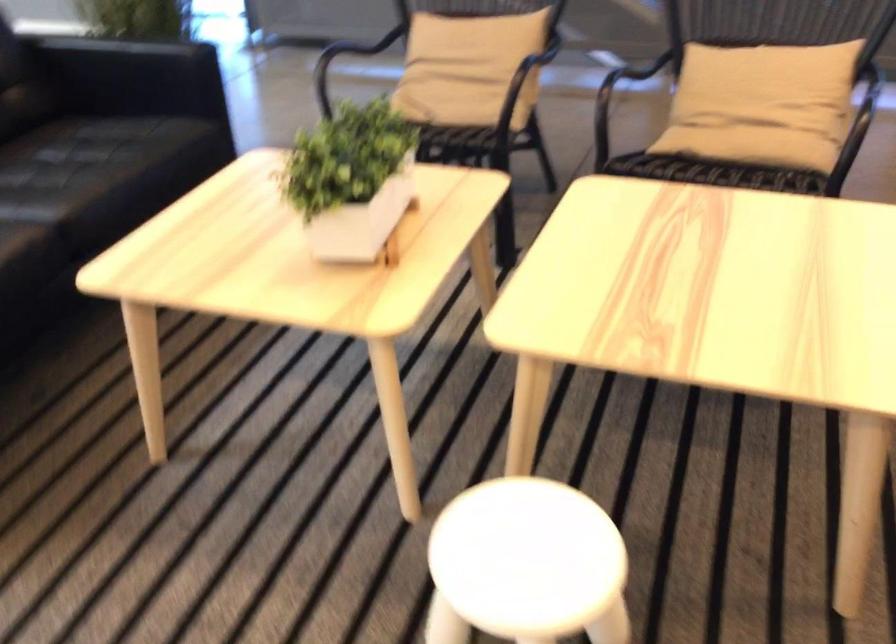
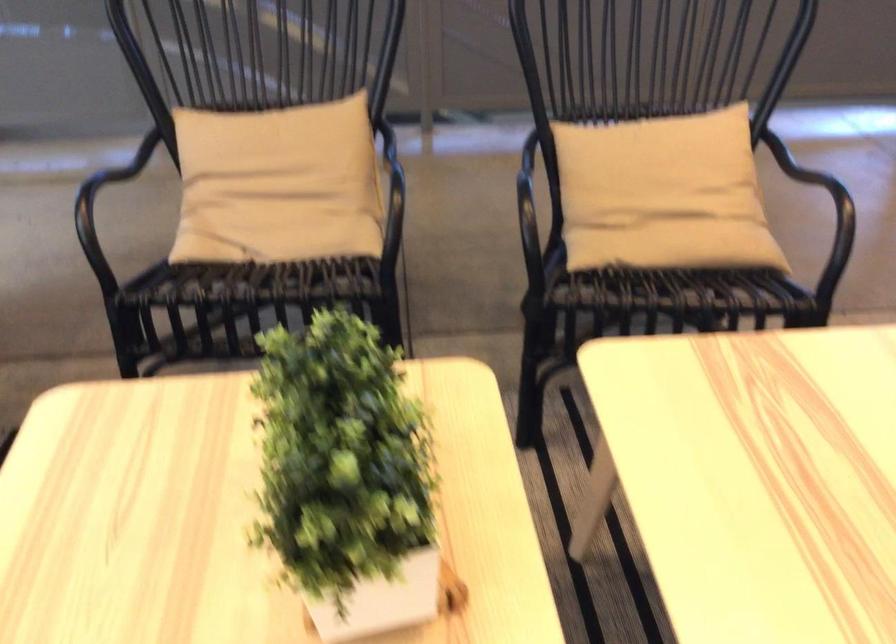
Find the pixel in the second image that matches point 325,156 in the first image.

(346, 477)